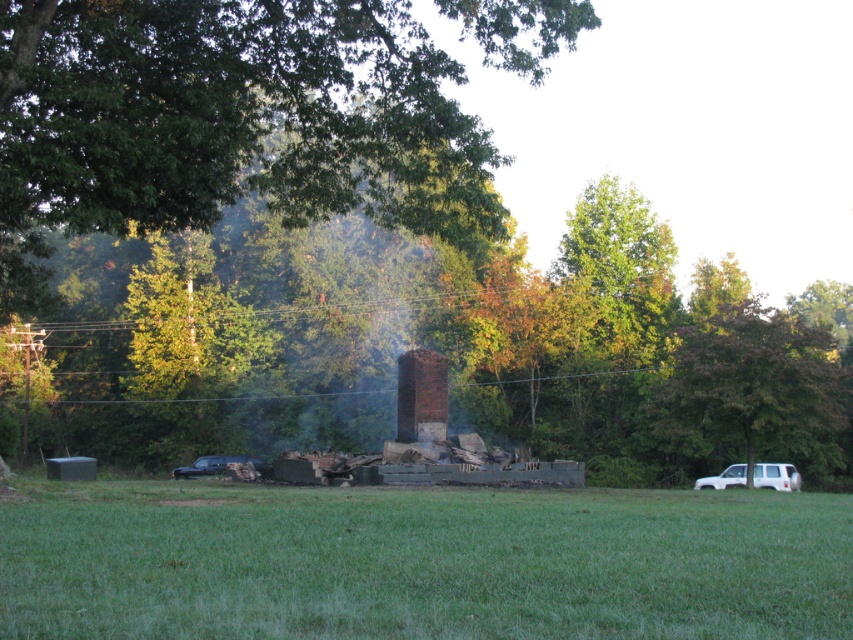
Question: Which is nearer to the green leafy tree at upper center?

Choices:
 (A) white matte suv at lower right
 (B) green grass at center
 (C) black matte car at lower left

Answer: (B)

Question: Which of the following is the closest to the observer?

Choices:
 (A) (198, 465)
 (B) (277, 548)
 (C) (410, 440)
 (D) (798, 477)

Answer: (B)

Question: Does white matte suv at lower right have a greater width compared to black matte car at lower left?

Choices:
 (A) no
 (B) yes

Answer: (A)

Question: Where is green leafy tree at center located in relation to green leafy tree at upper center in the image?

Choices:
 (A) below
 (B) above

Answer: (A)

Question: Which object is the closest to the white matte suv at lower right?

Choices:
 (A) green leafy tree at upper center
 (B) green grass at center
 (C) black matte car at lower left

Answer: (B)

Question: Does green grass at center appear over brown textured tree at right?

Choices:
 (A) yes
 (B) no

Answer: (B)